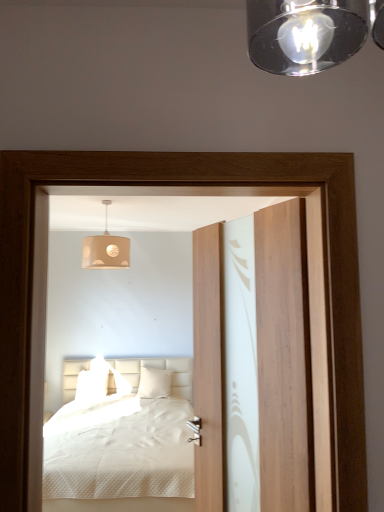
Question: Is white textured bed at center far away from transparent wood screen door at center?

Choices:
 (A) yes
 (B) no

Answer: (A)

Question: Could you tell me if white textured bed at center is facing transparent wood screen door at center?

Choices:
 (A) no
 (B) yes

Answer: (A)

Question: From a real-world perspective, does white textured bed at center stand above transparent wood screen door at center?

Choices:
 (A) yes
 (B) no

Answer: (B)

Question: Considering the relative sizes of white textured bed at center and transparent wood screen door at center in the image provided, is white textured bed at center shorter than transparent wood screen door at center?

Choices:
 (A) yes
 (B) no

Answer: (A)

Question: From the image's perspective, is white textured bed at center located above transparent wood screen door at center?

Choices:
 (A) no
 (B) yes

Answer: (A)

Question: From the image's perspective, relative to white textured bed at center, is beige fabric lampshade at upper center above or below?

Choices:
 (A) below
 (B) above

Answer: (B)

Question: In the image, is beige fabric lampshade at upper center on the left side or the right side of white textured bed at center?

Choices:
 (A) left
 (B) right

Answer: (A)

Question: In terms of height, does beige fabric lampshade at upper center look taller or shorter compared to white textured bed at center?

Choices:
 (A) short
 (B) tall

Answer: (A)

Question: Is beige fabric lampshade at upper center inside the boundaries of white textured bed at center, or outside?

Choices:
 (A) outside
 (B) inside

Answer: (A)

Question: Do you think transparent wood screen door at center is within wooden door at center, or outside of it?

Choices:
 (A) inside
 (B) outside

Answer: (B)

Question: Considering the positions of transparent wood screen door at center and wooden door at center in the image, is transparent wood screen door at center wider or thinner than wooden door at center?

Choices:
 (A) wide
 (B) thin

Answer: (A)

Question: Is transparent wood screen door at center to the left or to the right of wooden door at center in the image?

Choices:
 (A) right
 (B) left

Answer: (B)

Question: Based on their sizes in the image, would you say transparent wood screen door at center is bigger or smaller than wooden door at center?

Choices:
 (A) small
 (B) big

Answer: (A)

Question: Is point (170, 479) closer or farther from the camera than point (192, 199)?

Choices:
 (A) farther
 (B) closer

Answer: (B)

Question: Is white textured bed at center spatially inside transparent wood screen door at center, or outside of it?

Choices:
 (A) inside
 (B) outside

Answer: (B)